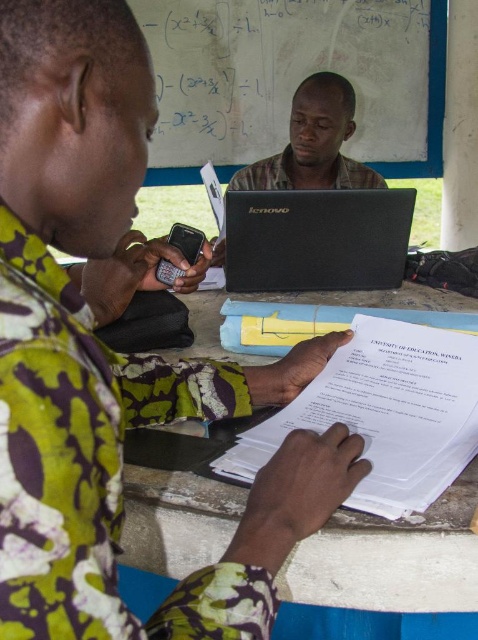
You are organizing a meeting and need to place both the matte black laptop at center and the black matte phone at left on the table. According to their positions in the image, which object should be placed to the right side of the other?

The matte black laptop at center should be placed to the right of the black matte phone at left as per their positions in the image.

You are a person sitting at the table and need to reach both the black matte laptop at center and the black matte phone at left. Which device is closer to your left side?

The black matte phone at left is closer to your left side since it is positioned to the left of the black matte laptop at center.

You are organizing a conference and need to place both the matte black laptop at center and the black matte phone at left on a table. The table has a width of 1 meter. If the laptop is twice as wide as the phone, will both items fit side by side without overlapping?

The matte black laptop at center is wider than the black matte phone at left. Since the laptop is twice as wide as the phone, the combined width would be three times the phone width. If the phone is, for example, 15 cm wide, the laptop would be 30 cm, totaling 45 cm. Since 45 cm is less than 1 meter, they can fit side by side without overlapping.